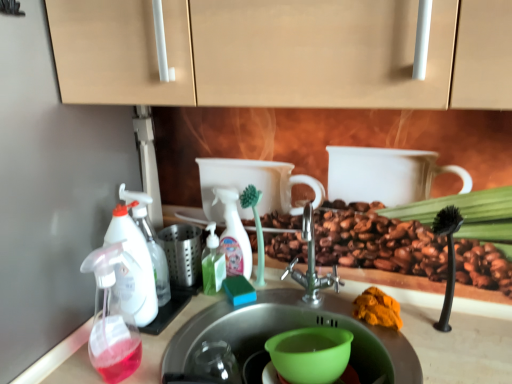
This screenshot has height=384, width=512. I want to click on free space above transparent plastic spray bottle at left, the 1th sink ordered from the bottom (from a real-world perspective), so click(212, 316).